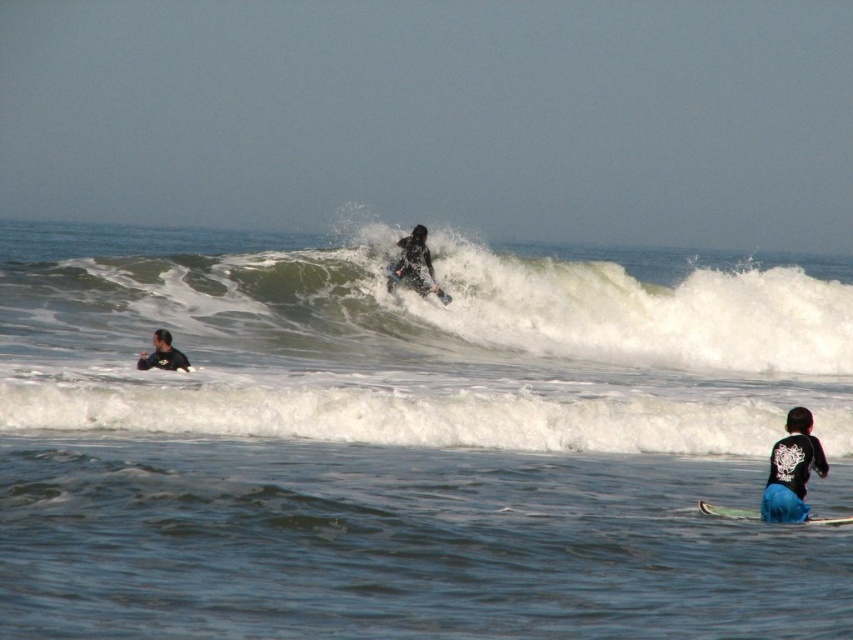
Can you confirm if dark matte wetsuit at center is positioned to the left of blue matte surfboard at lower right?

Indeed, dark matte wetsuit at center is positioned on the left side of blue matte surfboard at lower right.

Does dark matte wetsuit at center have a larger size compared to blue matte surfboard at lower right?

Yes, dark matte wetsuit at center is bigger than blue matte surfboard at lower right.

Is point (427, 262) closer to viewer compared to point (732, 508)?

No, it is behind (732, 508).

I want to click on dark matte wetsuit at center, so click(415, 262).

Is smooth black surfboard at center below blue matte surfboard at lower right?

No, smooth black surfboard at center is not below blue matte surfboard at lower right.

Can you confirm if smooth black surfboard at center is positioned above blue matte surfboard at lower right?

Yes, smooth black surfboard at center is above blue matte surfboard at lower right.

Does point (415, 288) come farther from viewer compared to point (809, 516)?

Yes, it is behind point (809, 516).

The width and height of the screenshot is (853, 640). I want to click on smooth black surfboard at center, so click(415, 282).

Between white frothy wave at center and smooth black surfboard at center, which one appears on the right side from the viewer's perspective?

Positioned to the right is smooth black surfboard at center.

Does point (302, 324) come closer to viewer compared to point (444, 296)?

Yes, point (302, 324) is closer to viewer.

At what (x,y) coordinates should I click in order to perform the action: click on white frothy wave at center. Please return your answer as a coordinate pair (x, y). This screenshot has width=853, height=640. Looking at the image, I should click on (418, 305).